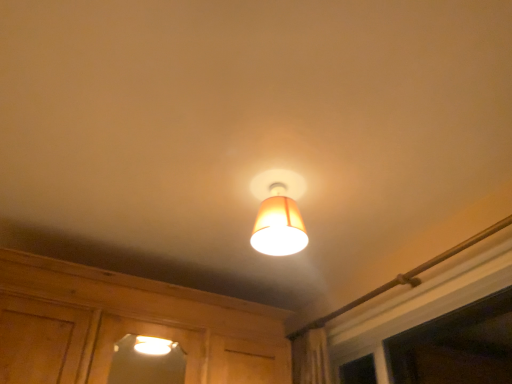
Question: From a real-world perspective, is white plastic window at upper right positioned above or below matte orange fabric lampshade at center?

Choices:
 (A) below
 (B) above

Answer: (A)

Question: Considering the positions of white plastic window at upper right and matte orange fabric lampshade at center in the image, is white plastic window at upper right bigger or smaller than matte orange fabric lampshade at center?

Choices:
 (A) small
 (B) big

Answer: (B)

Question: Considering the positions of white plastic window at upper right and matte orange fabric lampshade at center in the image, is white plastic window at upper right wider or thinner than matte orange fabric lampshade at center?

Choices:
 (A) wide
 (B) thin

Answer: (B)

Question: Relative to white plastic window at upper right, is matte orange fabric lampshade at center in front or behind?

Choices:
 (A) behind
 (B) front

Answer: (A)

Question: Is matte orange fabric lampshade at center wider or thinner than white plastic window at upper right?

Choices:
 (A) wide
 (B) thin

Answer: (A)

Question: In the image, is matte orange fabric lampshade at center on the left side or the right side of white plastic window at upper right?

Choices:
 (A) left
 (B) right

Answer: (A)

Question: Looking at the image, does matte orange fabric lampshade at center seem bigger or smaller compared to white plastic window at upper right?

Choices:
 (A) big
 (B) small

Answer: (B)